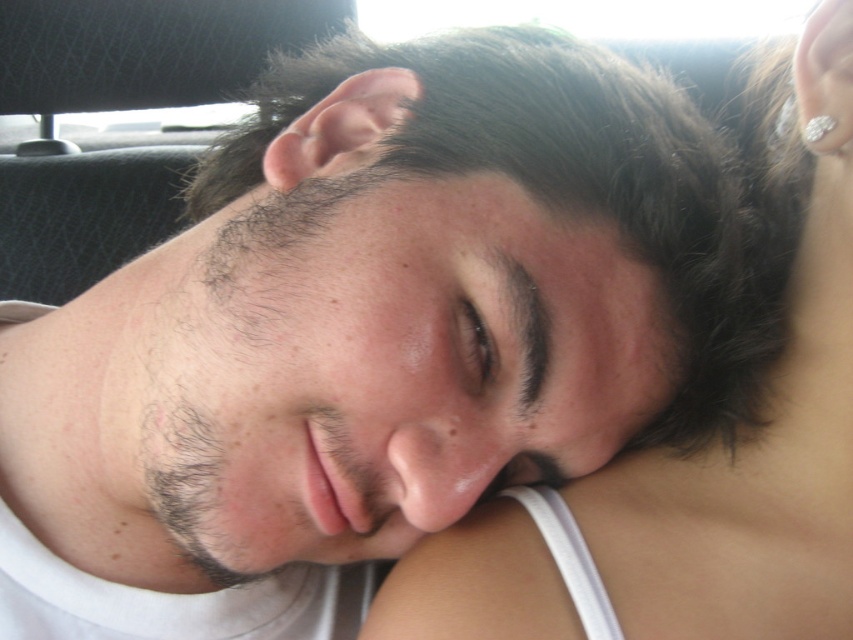
You are a passenger in a car and want to reach two points inside the vehicle. The first point is at coordinate point (656, 164) and the second is at point (483, 368). Which point is closer to you?

Point (656, 164) is further to the viewer than point (483, 368), so the second point is closer to you.

Consider the image. You are a photographer taking a picture of two people in a car. You notice the dark brown hair at center and the white fabric at upper center in your viewfinder. Which object will appear bigger in the photo?

The dark brown hair at center will appear bigger in the photo because it is larger in size than the white fabric at upper center.

You are a passenger in a car and you see the dark brown hair at center and the white fabric at upper center. Which one is closer to the left side of the car?

The dark brown hair at center is closer to the left side of the car since it is positioned to the left of the white fabric at upper center.